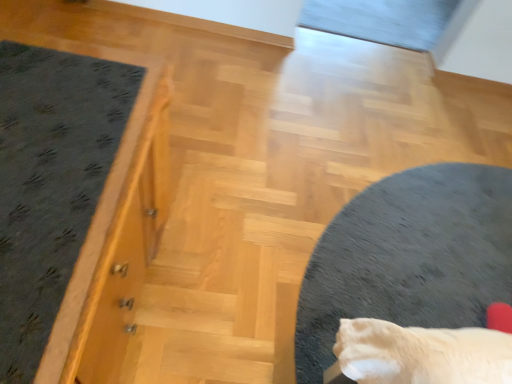
Locate an element on the screen. Image resolution: width=512 pixels, height=384 pixels. dark gray carpet at left is located at coordinates (50, 182).

This screenshot has width=512, height=384. What do you see at coordinates (50, 182) in the screenshot?
I see `dark gray carpet at left` at bounding box center [50, 182].

At what (x,y) coordinates should I click in order to perform the action: click on soft gray carpet at center. Please return your answer as a coordinate pair (x, y). This screenshot has width=512, height=384. Looking at the image, I should click on (409, 257).

What do you see at coordinates (409, 257) in the screenshot?
I see `soft gray carpet at center` at bounding box center [409, 257].

Find the location of a particular element. dark gray carpet at left is located at coordinates (50, 182).

Is soft gray carpet at center at the right side of dark gray carpet at left?

Indeed, soft gray carpet at center is positioned on the right side of dark gray carpet at left.

Which object is further away from the camera taking this photo, soft gray carpet at center or dark gray carpet at left?

soft gray carpet at center is behind.

Which is closer, (358, 228) or (101, 87)?

The point (101, 87) is in front.

From the image's perspective, which is below, soft gray carpet at center or dark gray carpet at left?

soft gray carpet at center appears lower in the image.

From a real-world perspective, who is located lower, soft gray carpet at center or dark gray carpet at left?

soft gray carpet at center.

Which of these two, soft gray carpet at center or dark gray carpet at left, is thinner?

dark gray carpet at left is thinner.

Considering the relative sizes of soft gray carpet at center and dark gray carpet at left in the image provided, is soft gray carpet at center taller than dark gray carpet at left?

No.

Looking at the image, does soft gray carpet at center seem bigger or smaller compared to dark gray carpet at left?

soft gray carpet at center is smaller than dark gray carpet at left.

Is dark gray carpet at left surrounded by soft gray carpet at center?

No, dark gray carpet at left is not surrounded by soft gray carpet at center.

Is soft gray carpet at center beside dark gray carpet at left?

No, soft gray carpet at center is not with dark gray carpet at left.

Is soft gray carpet at center oriented away from dark gray carpet at left?

No, dark gray carpet at left is not at the back of soft gray carpet at center.

How different are the orientations of soft gray carpet at center and dark gray carpet at left in degrees?

180 degrees separate the facing orientations of soft gray carpet at center and dark gray carpet at left.

Measure the distance from soft gray carpet at center to dark gray carpet at left.

soft gray carpet at center is 3.89 feet away from dark gray carpet at left.

Where is `mat in front of the soft gray carpet at center`? mat in front of the soft gray carpet at center is located at coordinates coord(50,182).

Which is more to the right, dark gray carpet at left or soft gray carpet at center?

Positioned to the right is soft gray carpet at center.

Considering the positions of objects dark gray carpet at left and soft gray carpet at center in the image provided, who is in front, dark gray carpet at left or soft gray carpet at center?

dark gray carpet at left is more forward.

Which is in front, point (33, 95) or point (296, 352)?

Positioned in front is point (33, 95).

From the image's perspective, between dark gray carpet at left and soft gray carpet at center, which one is located above?

dark gray carpet at left, from the image's perspective.

From a real-world perspective, who is located higher, dark gray carpet at left or soft gray carpet at center?

From a 3D spatial view, dark gray carpet at left is above.

From the picture: Looking at their sizes, would you say dark gray carpet at left is wider or thinner than soft gray carpet at center?

dark gray carpet at left is thinner than soft gray carpet at center.

Between dark gray carpet at left and soft gray carpet at center, which one has more height?

dark gray carpet at left is taller.

Can you confirm if dark gray carpet at left is bigger than soft gray carpet at center?

Correct, dark gray carpet at left is larger in size than soft gray carpet at center.

Is dark gray carpet at left situated inside soft gray carpet at center or outside?

dark gray carpet at left is not inside soft gray carpet at center, it's outside.

Would you consider dark gray carpet at left to be distant from soft gray carpet at center?

Yes, dark gray carpet at left is far from soft gray carpet at center.

Is dark gray carpet at left positioned with its back to soft gray carpet at center?

No, soft gray carpet at center is not at the back of dark gray carpet at left.

How different are the orientations of dark gray carpet at left and soft gray carpet at center in degrees?

The angular difference between dark gray carpet at left and soft gray carpet at center is 180 degrees.

Measure the distance between dark gray carpet at left and soft gray carpet at center.

dark gray carpet at left and soft gray carpet at center are 1.18 meters apart.

This screenshot has height=384, width=512. I want to click on mat above the soft gray carpet at center (from a real-world perspective), so click(x=50, y=182).

At what (x,y) coordinates should I click in order to perform the action: click on mat above the soft gray carpet at center (from the image's perspective). Please return your answer as a coordinate pair (x, y). This screenshot has width=512, height=384. Looking at the image, I should click on (50, 182).

What are the coordinates of `mat located in front of the soft gray carpet at center` in the screenshot? It's located at (50, 182).